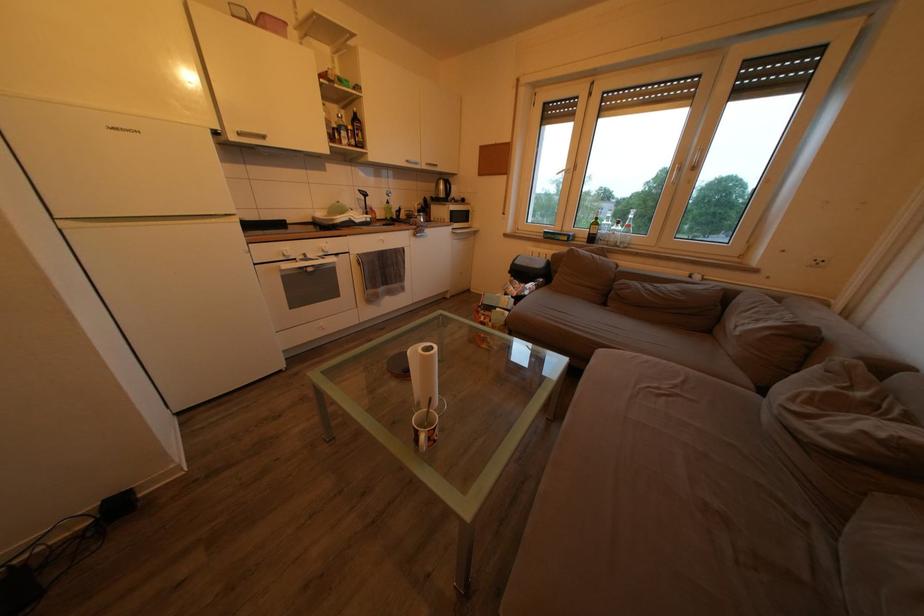
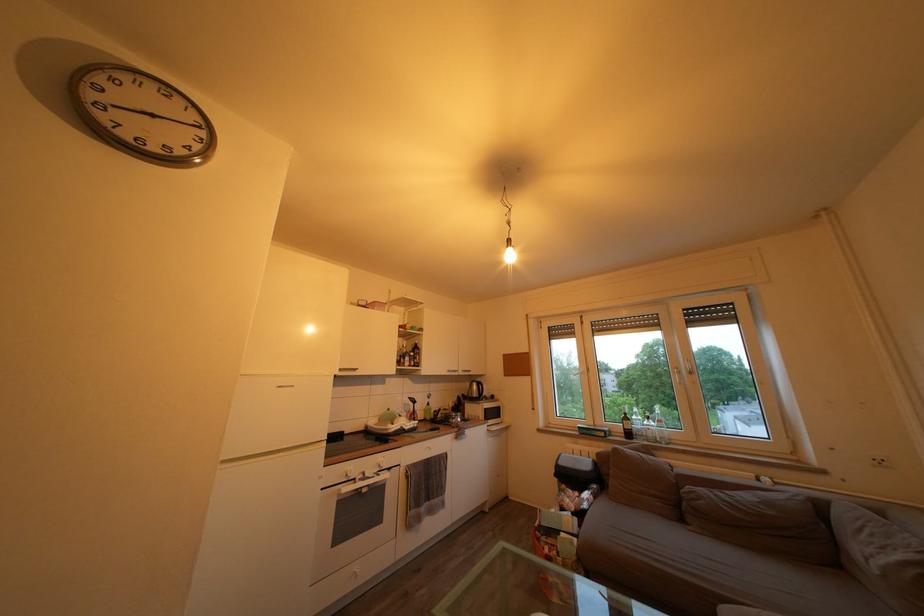
Find the pixel in the second image that matches (395,209) in the first image.

(436, 411)